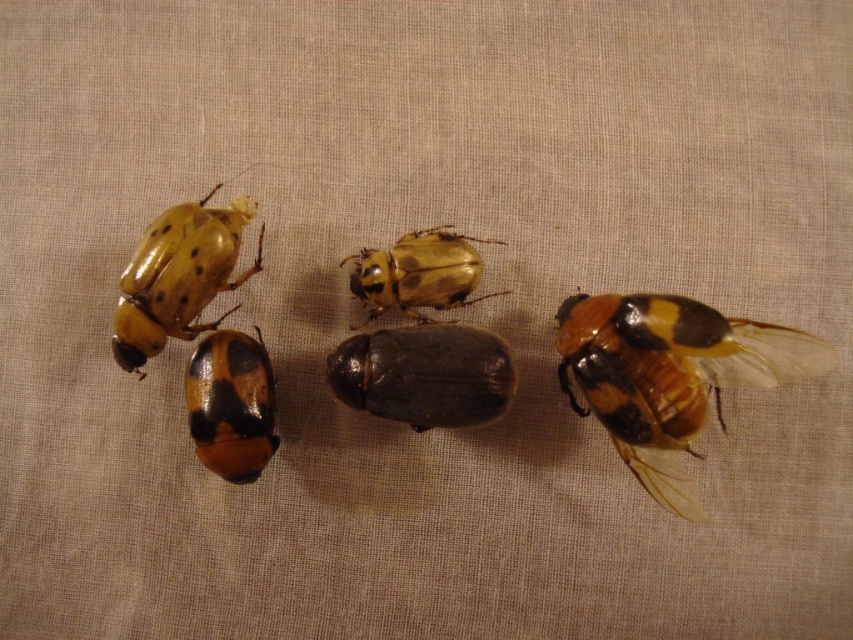
Question: Where is black matte beetle at center located in relation to matte yellow beetle at center in the image?

Choices:
 (A) above
 (B) below

Answer: (B)

Question: Among these points, which one is nearest to the camera?

Choices:
 (A) (505, 388)
 (B) (195, 448)

Answer: (A)

Question: Which point is closer to the camera taking this photo?

Choices:
 (A) (222, 344)
 (B) (149, 243)
 (C) (502, 396)

Answer: (B)

Question: Is black matte beetle at center above matte black beetle at center?

Choices:
 (A) no
 (B) yes

Answer: (B)

Question: Does brown matte beetle at center come behind matte yellow beetle at center?

Choices:
 (A) no
 (B) yes

Answer: (A)

Question: Among these points, which one is nearest to the camera?

Choices:
 (A) (245, 467)
 (B) (236, 216)

Answer: (A)